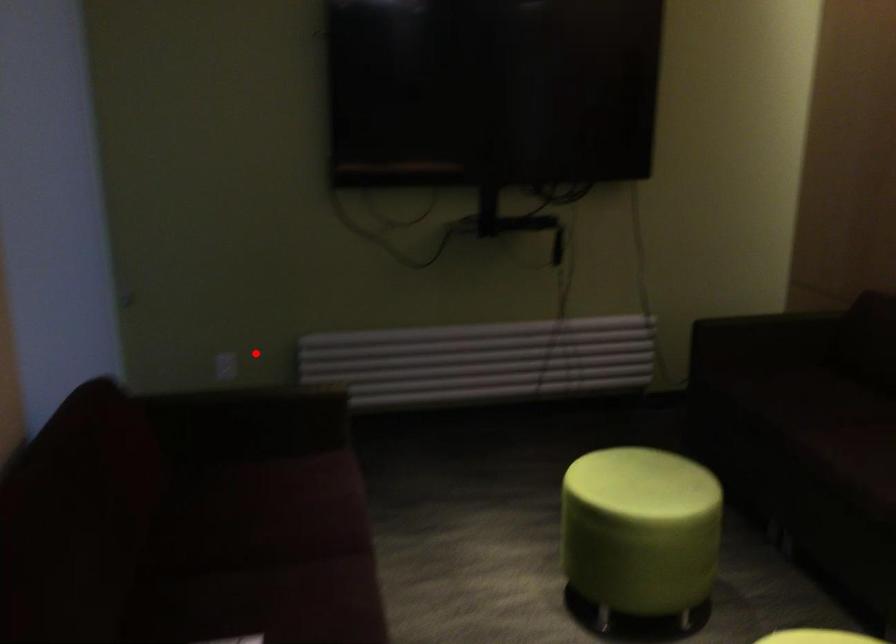
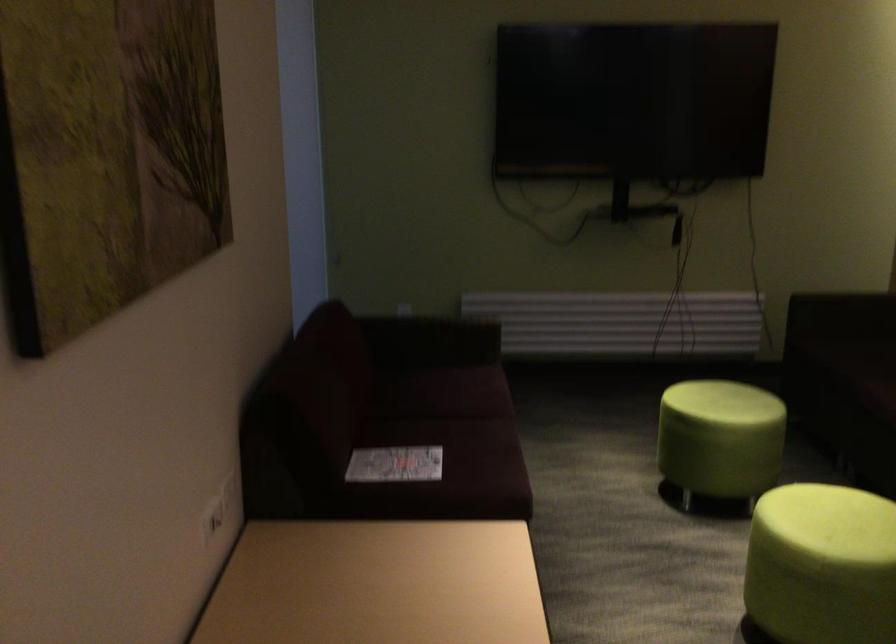
Question: I am providing you with two images of the same scene from different viewpoints. In image1, a red point is highlighted. Considering the same 3D point in image2, which of the following is correct?

Choices:
 (A) It is closer
 (B) It is farther

Answer: (B)